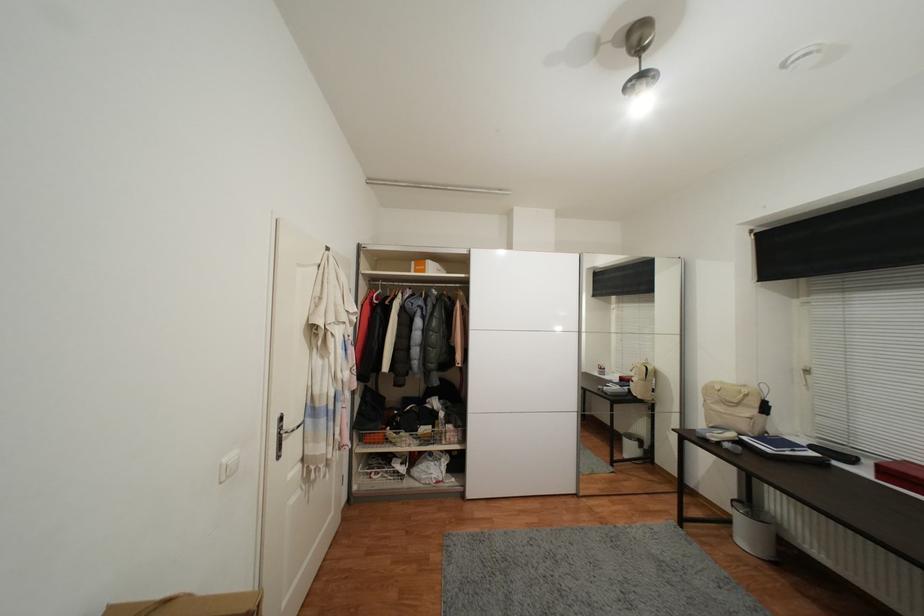
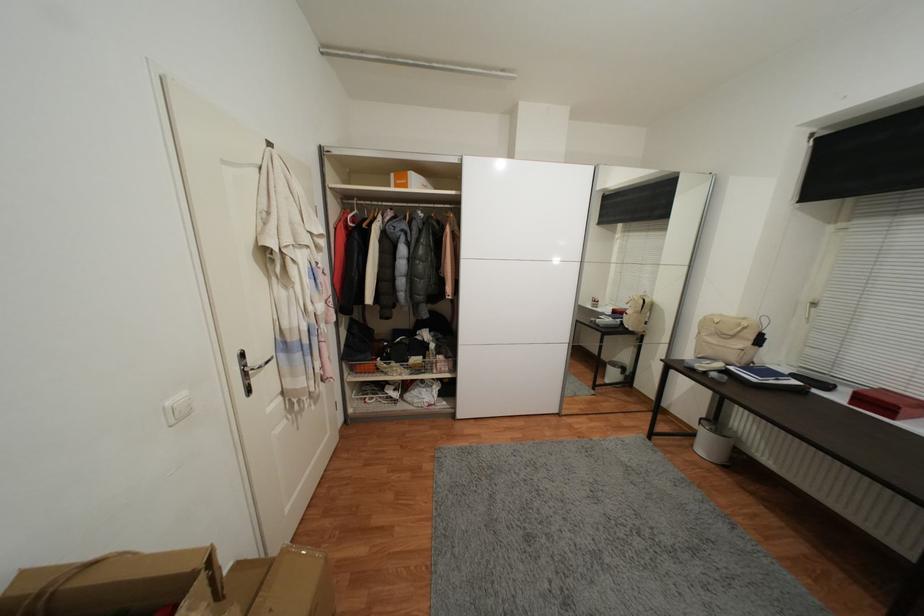
The point at (855,461) is marked in the first image. Where is the corresponding point in the second image?

(831, 387)